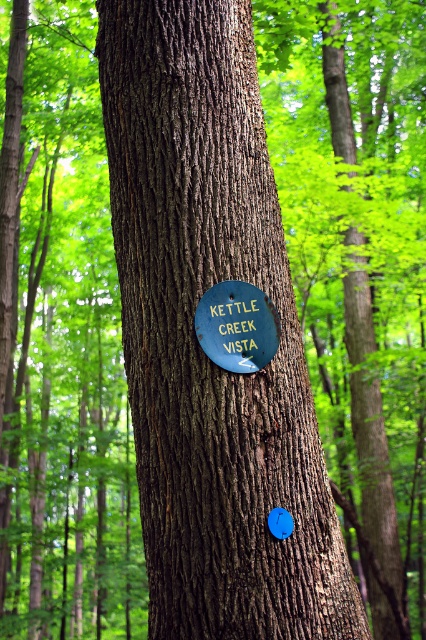
Which is more to the right, smooth brown bark at center or green matte sign at center?

green matte sign at center is more to the right.

Which is behind, point (298, 369) or point (249, 304)?

The point (298, 369) is more distant.

Is point (196, 595) positioned before point (207, 296)?

That is True.

At what (x,y) coordinates should I click in order to perform the action: click on smooth brown bark at center. Please return your answer as a coordinate pair (x, y). Looking at the image, I should click on (198, 342).